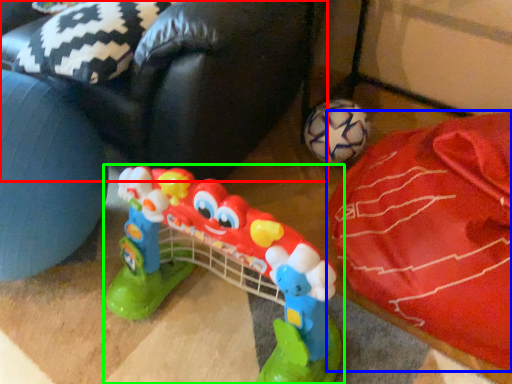
Question: Estimate the real-world distances between objects in this image. Which object is closer to bean bag chair (highlighted by a red box), material (highlighted by a blue box) or toy (highlighted by a green box)?

Choices:
 (A) material
 (B) toy

Answer: (B)